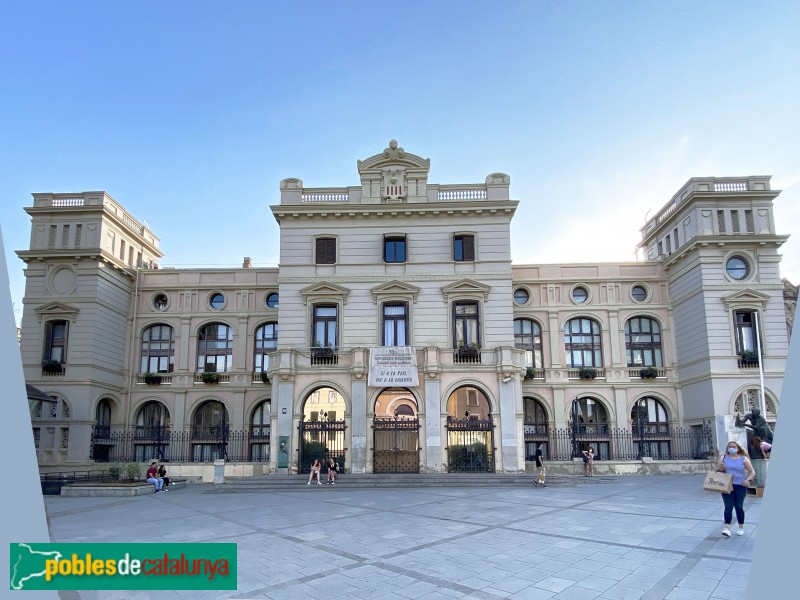
The width and height of the screenshot is (800, 600). Find the location of `plant`. plant is located at coordinates (134, 468).